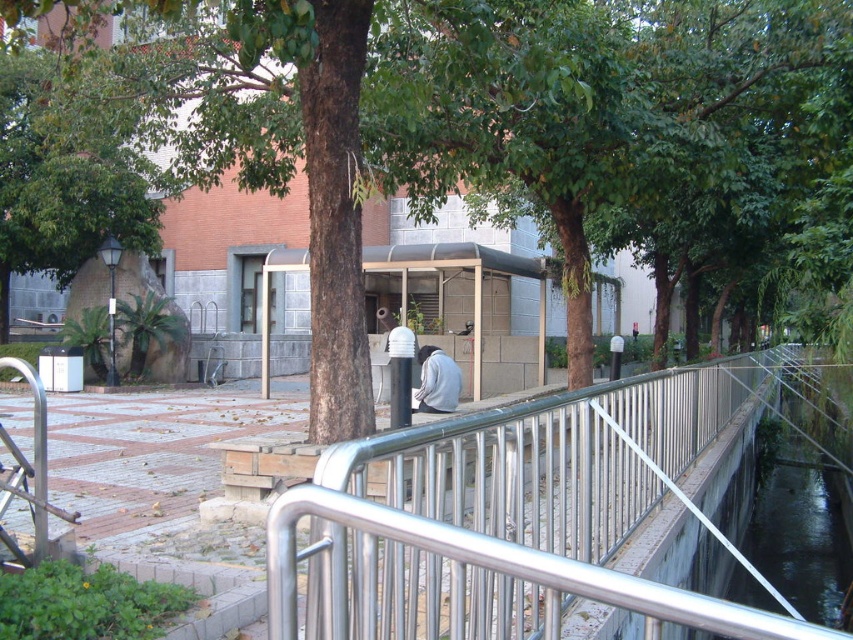
Which of these two, brown textured tree at center or silver metallic railing at center, stands shorter?

With less height is silver metallic railing at center.

From the picture: Does brown textured tree at center have a lesser width compared to silver metallic railing at center?

Incorrect, brown textured tree at center's width is not less than silver metallic railing at center's.

Image resolution: width=853 pixels, height=640 pixels. Describe the element at coordinates (492, 131) in the screenshot. I see `brown textured tree at center` at that location.

The height and width of the screenshot is (640, 853). Identify the location of brown textured tree at center. pos(492,131).

This screenshot has height=640, width=853. I want to click on silver metallic railing at center, so coord(509,516).

How far apart are silver metallic railing at center and clear glass waterway at center?

silver metallic railing at center is 4.37 meters away from clear glass waterway at center.

Is point (749, 612) positioned in front of point (846, 419)?

Yes, it is.

This screenshot has height=640, width=853. In order to click on silver metallic railing at center in this screenshot , I will do `click(509, 516)`.

Looking at this image, which is more to the right, brown textured tree at center or clear glass waterway at center?

clear glass waterway at center

Find the location of a particular element. brown textured tree at center is located at coordinates (492, 131).